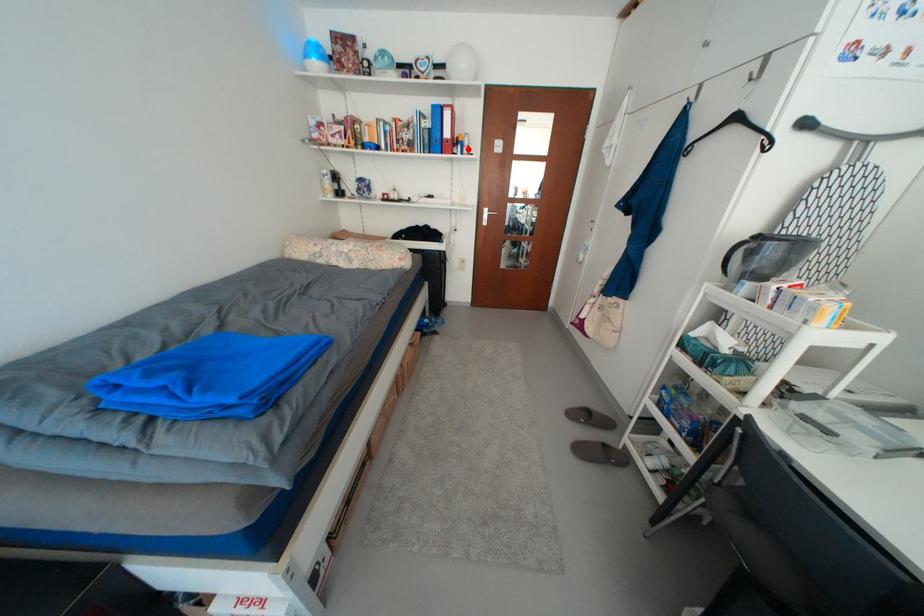
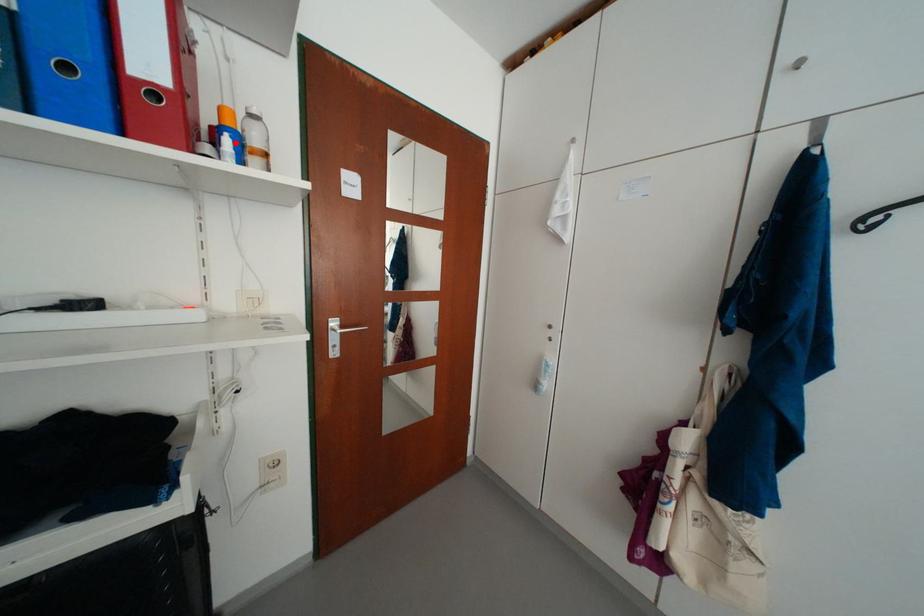
I am providing you with two images of the same scene from different viewpoints. A red point is marked on the first image and another point is marked on the second image. Is the marked point in image1 the same physical position as the marked point in image2?

Yes